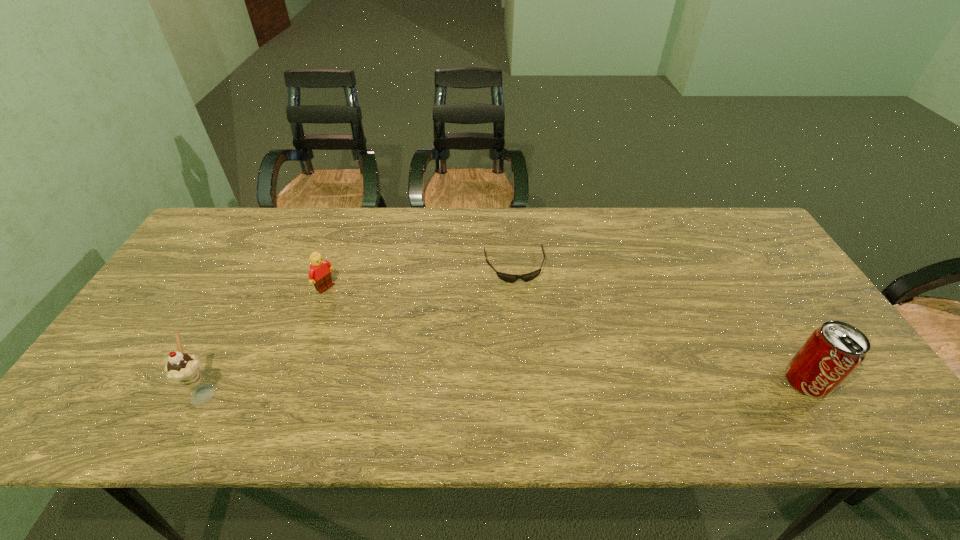
Locate an element on the screen. This screenshot has width=960, height=540. icecream is located at coordinates (183, 368).

Find the location of a particular element. The height and width of the screenshot is (540, 960). the rightmost object is located at coordinates (833, 351).

Find the location of a particular element. The image size is (960, 540). sunglasses is located at coordinates (510, 278).

You are a GUI agent. You are given a task and a screenshot of the screen. Output one action in this format:
    pyautogui.click(x=<x>, y=<y>)
    Task: Click on the shortest object
    The height and width of the screenshot is (540, 960).
    Given the screenshot: What is the action you would take?
    pyautogui.click(x=510, y=278)

At what (x,y) coordinates should I click in order to perform the action: click on Lego. Please return your answer as a coordinate pair (x, y). The height and width of the screenshot is (540, 960). Looking at the image, I should click on (319, 273).

Locate an element on the screen. The width and height of the screenshot is (960, 540). the second shortest object is located at coordinates (319, 273).

The image size is (960, 540). I want to click on free location located 0.120m on the right of the leftmost object, so click(273, 391).

You are a GUI agent. You are given a task and a screenshot of the screen. Output one action in this format:
    pyautogui.click(x=<x>, y=<y>)
    Task: Click on the vacant area situated on the left of the pop soda
    The image size is (960, 540).
    Given the screenshot: What is the action you would take?
    pyautogui.click(x=619, y=381)

Image resolution: width=960 pixels, height=540 pixels. In order to click on free space located on the front-facing side of the sunglasses in this screenshot , I will do `click(541, 386)`.

Where is `free location located 0.300m on the front-facing side of the sunglasses`? The image size is (960, 540). free location located 0.300m on the front-facing side of the sunglasses is located at coordinates (539, 371).